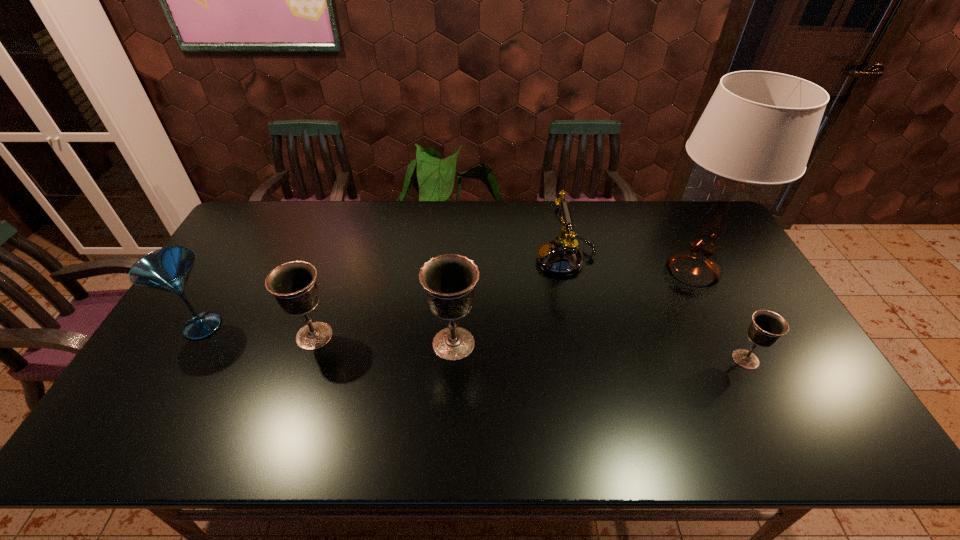
This screenshot has height=540, width=960. I want to click on free region located on the right of the shortest chalice, so click(795, 359).

At what (x,y) coordinates should I click in order to perform the action: click on vacant space located on the front-facing side of the tallest object. Please return your answer as a coordinate pair (x, y). The image size is (960, 540). Looking at the image, I should click on (623, 272).

Find the location of a particular element. The image size is (960, 540). free space located on the front-facing side of the tallest object is located at coordinates (529, 272).

The image size is (960, 540). I want to click on vacant space located on the front-facing side of the tallest object, so click(557, 272).

At what (x,y) coordinates should I click in order to perform the action: click on free location located on the dial of the telephone. Please return your answer as a coordinate pair (x, y). The width and height of the screenshot is (960, 540). Looking at the image, I should click on (436, 258).

The width and height of the screenshot is (960, 540). In order to click on free location located on the dial of the telephone in this screenshot , I will do click(436, 258).

Locate an element on the screen. Image resolution: width=960 pixels, height=540 pixels. free space located 0.230m on the dial of the telephone is located at coordinates (466, 258).

At what (x,y) coordinates should I click in order to perform the action: click on free space located 0.100m on the front of the leftmost object. Please return your answer as a coordinate pair (x, y). The height and width of the screenshot is (540, 960). Looking at the image, I should click on (172, 379).

The image size is (960, 540). Identify the location of object at the far edge. (562, 256).

Where is `object that is at the left edge`? The height and width of the screenshot is (540, 960). object that is at the left edge is located at coordinates [x=167, y=269].